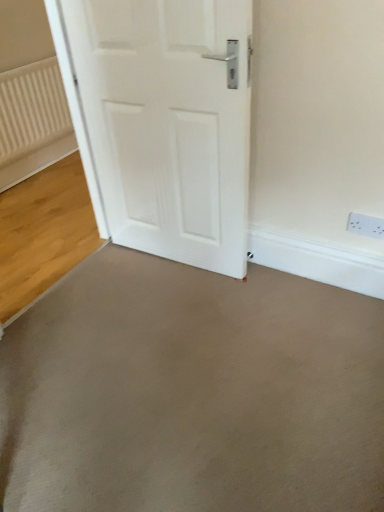
Locate an element on the screen. The width and height of the screenshot is (384, 512). vacant space situated above smooth concrete floor at center, the 1th concrete positioned from the front (from a real-world perspective) is located at coordinates (188, 365).